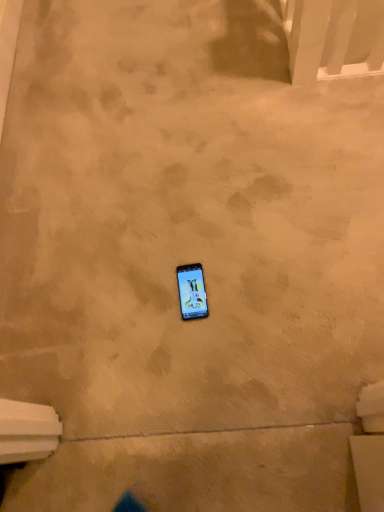
Image resolution: width=384 pixels, height=512 pixels. Find the location of `vacant space in front of matte black phone at center`. vacant space in front of matte black phone at center is located at coordinates (204, 352).